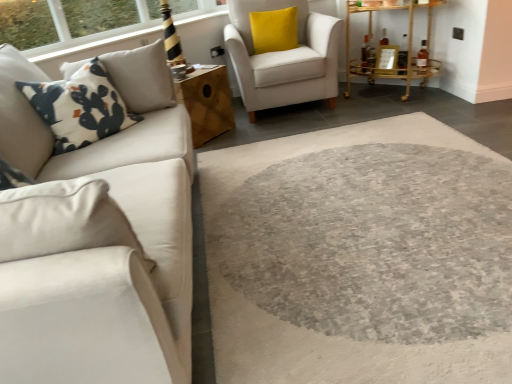
Question: From a real-world perspective, is white printed fabric pillow at left on top of yellow velvet pillow at upper right?

Choices:
 (A) no
 (B) yes

Answer: (B)

Question: Is white printed fabric pillow at left looking in the opposite direction of yellow velvet pillow at upper right?

Choices:
 (A) yes
 (B) no

Answer: (B)

Question: Does white printed fabric pillow at left come in front of yellow velvet pillow at upper right?

Choices:
 (A) no
 (B) yes

Answer: (B)

Question: From the image's perspective, is white printed fabric pillow at left above yellow velvet pillow at upper right?

Choices:
 (A) no
 (B) yes

Answer: (A)

Question: Is white printed fabric pillow at left to the right of yellow velvet pillow at upper right from the viewer's perspective?

Choices:
 (A) yes
 (B) no

Answer: (B)

Question: Considering the positions of yellow velvet pillow at upper right and wooden cube at center, the 1th table in the left-to-right sequence, in the image, is yellow velvet pillow at upper right taller or shorter than wooden cube at center, the 1th table in the left-to-right sequence,?

Choices:
 (A) short
 (B) tall

Answer: (A)

Question: From a real-world perspective, is yellow velvet pillow at upper right positioned above or below wooden cube at center, the 1th table in the left-to-right sequence?

Choices:
 (A) above
 (B) below

Answer: (A)

Question: Looking at their shapes, would you say yellow velvet pillow at upper right is wider or thinner than wooden cube at center, the 1th table in the left-to-right sequence?

Choices:
 (A) thin
 (B) wide

Answer: (A)

Question: Choose the correct answer: Is yellow velvet pillow at upper right inside wooden cube at center, the 1th table in the left-to-right sequence, or outside it?

Choices:
 (A) outside
 (B) inside

Answer: (A)

Question: Which is correct: white printed fabric pillow at left is inside yellow velvet pillow at upper right, or outside of it?

Choices:
 (A) inside
 (B) outside

Answer: (B)

Question: Is white printed fabric pillow at left in front of or behind yellow velvet pillow at upper right in the image?

Choices:
 (A) behind
 (B) front

Answer: (B)

Question: In terms of width, does white printed fabric pillow at left look wider or thinner when compared to yellow velvet pillow at upper right?

Choices:
 (A) thin
 (B) wide

Answer: (B)

Question: Is point (93, 66) positioned closer to the camera than point (257, 28)?

Choices:
 (A) closer
 (B) farther

Answer: (A)

Question: Based on their sizes in the image, would you say satin white couch at left is bigger or smaller than yellow velvet pillow at upper right?

Choices:
 (A) small
 (B) big

Answer: (B)

Question: From the image's perspective, is satin white couch at left positioned above or below yellow velvet pillow at upper right?

Choices:
 (A) above
 (B) below

Answer: (B)